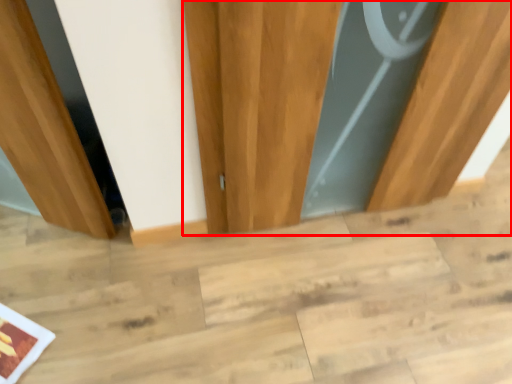
Question: From the image's perspective, what is the correct spatial positioning of door (annotated by the red box) in reference to stair?

Choices:
 (A) above
 (B) below

Answer: (A)